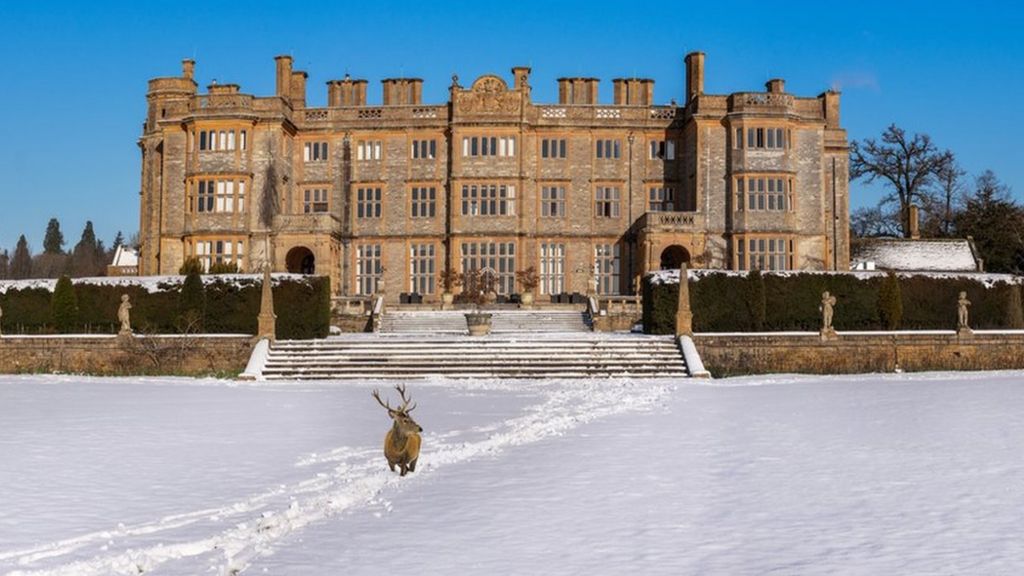
Locate an element on the screen. The image size is (1024, 576). statue is located at coordinates (123, 325), (825, 309).